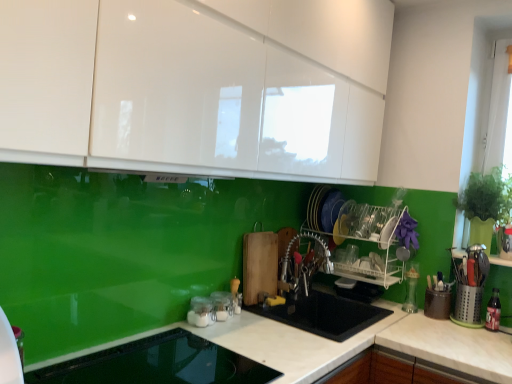
Identify the location of free location to the right of clear glass jars at center, positioned as the 3th appliance in left-to-right order. The width and height of the screenshot is (512, 384). (257, 322).